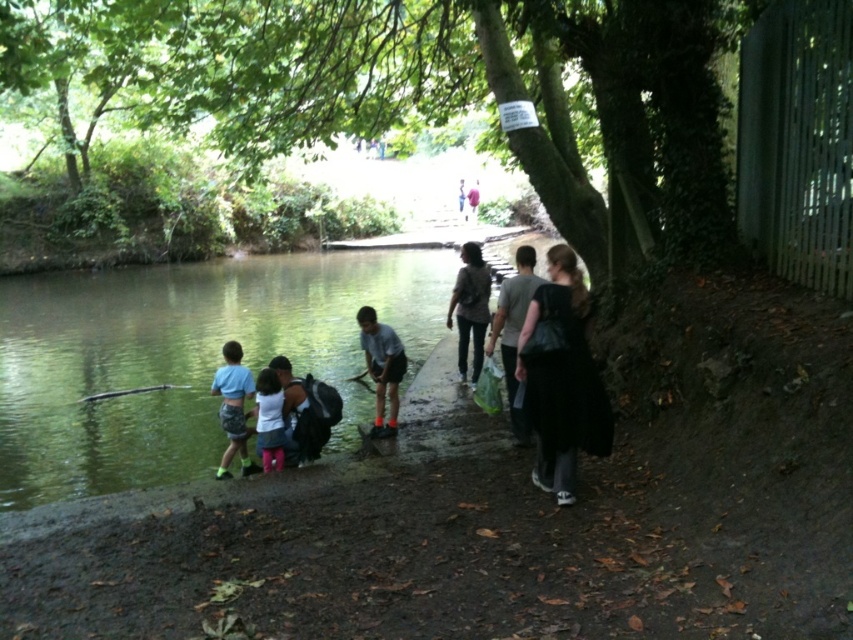
You are standing at the riverbank and want to move from point A to point B. Point A is at coordinates point (190, 269) and point B is at coordinates point (387, 353). Since you can only move forward, will you have to walk towards or away from the river to reach point B from point A?

Point (190, 269) is further to the viewer than point (387, 353). Therefore, to move from point A to point B, you would need to walk away from the river since point B is farther away from your current position.

You are standing at the edge of the river and want to reach the light blue fabric shirt at center without getting your feet wet. The green smooth water at lower left is in your path. Can you walk around the water to reach the shirt safely?

The green smooth water at lower left is 30.56 feet away from the light blue fabric shirt at center, so yes, you can walk around the water to reach the shirt safely as the distance allows for a detour.

You are planning to cross the river using a small wooden bridge that can only support objects wider than the black fabric dress at right. Can the green smooth water at lower left fit on the bridge?

The green smooth water at lower left has a larger width than the black fabric dress at right. Since the bridge requires objects wider than the dress, the green smooth water at lower left is wider and therefore can fit on the bridge.